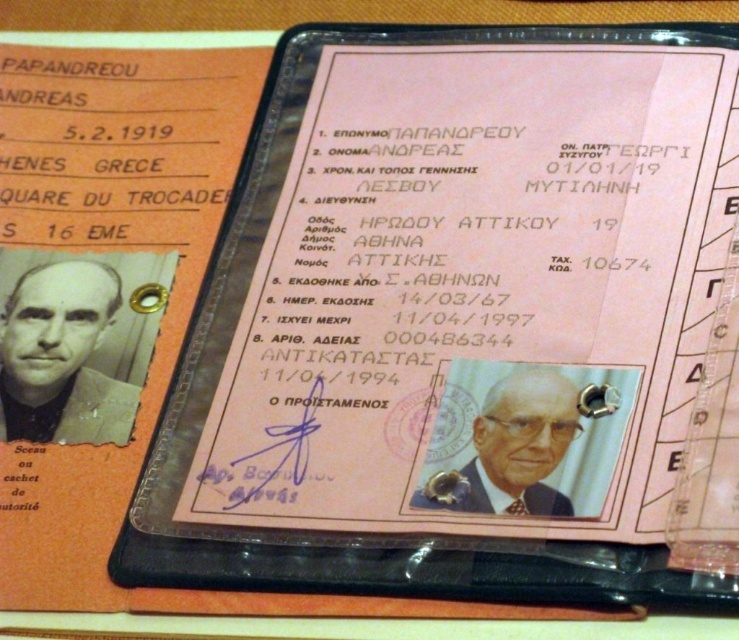
Question: Does gray hair man at left have a greater width compared to white textured photo at center?

Choices:
 (A) yes
 (B) no

Answer: (B)

Question: Which point is farther to the camera?

Choices:
 (A) (78, 278)
 (B) (554, 452)

Answer: (A)

Question: Does gray hair man at left have a smaller size compared to white textured photo at center?

Choices:
 (A) yes
 (B) no

Answer: (B)

Question: Is gray hair man at left bigger than white textured photo at center?

Choices:
 (A) no
 (B) yes

Answer: (B)